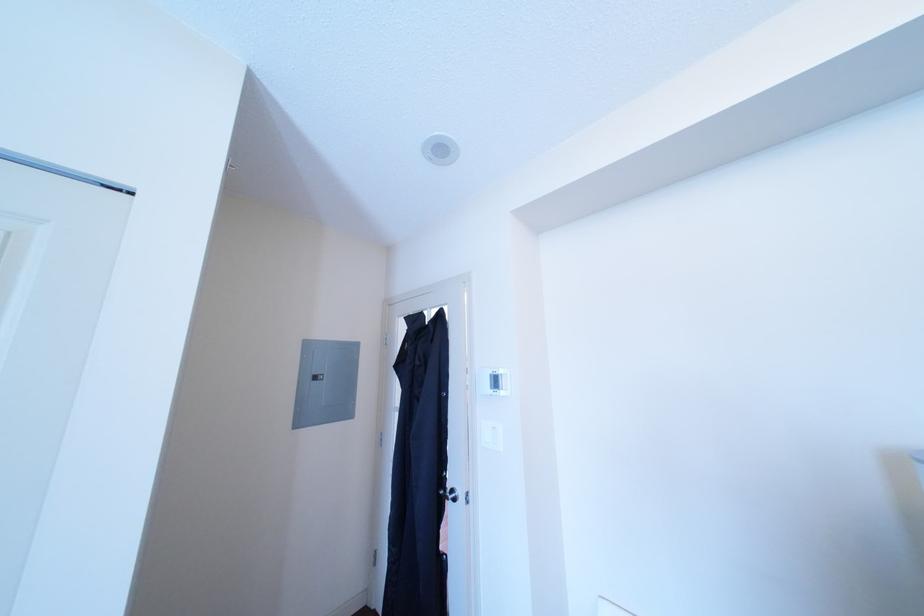
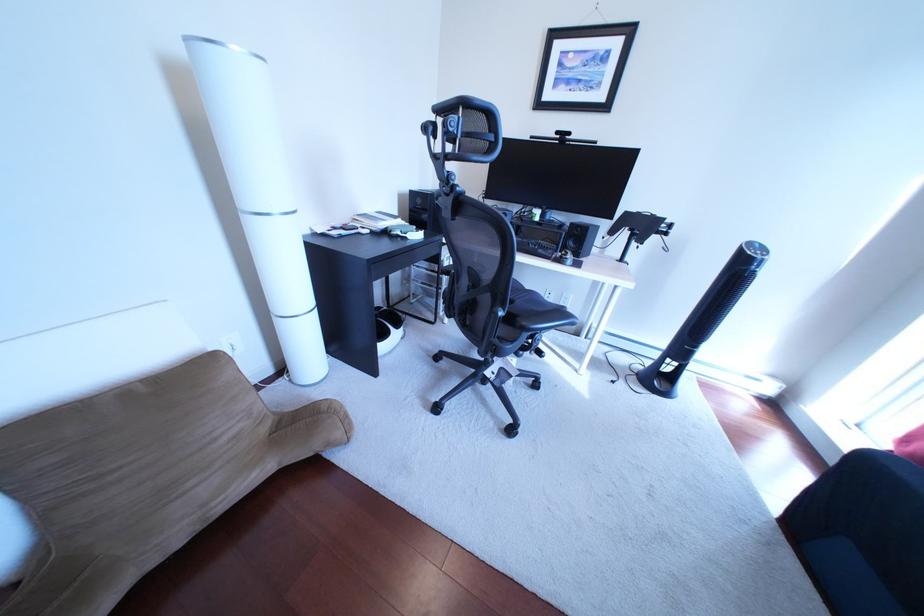
How did the camera likely rotate?

The rotation direction of the camera is right-down.